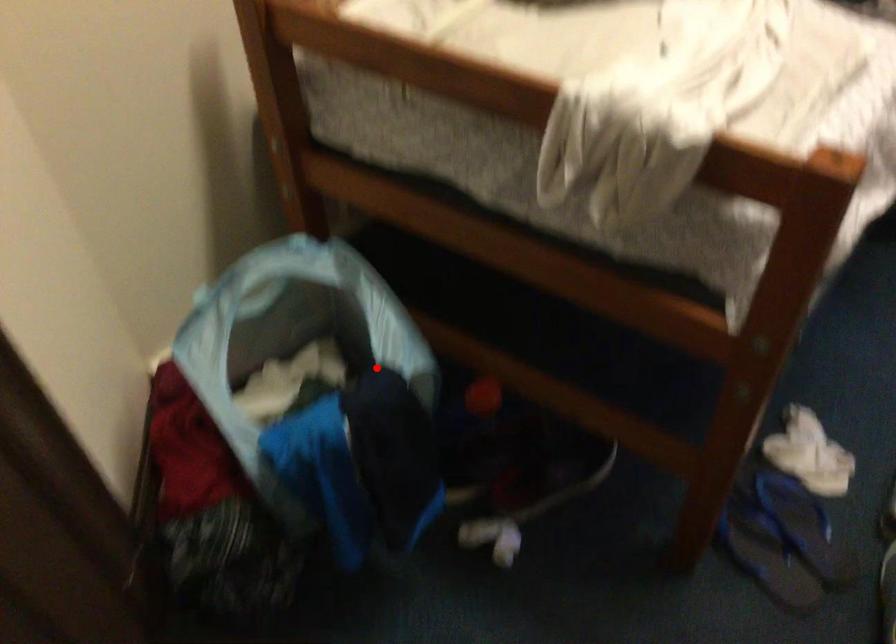
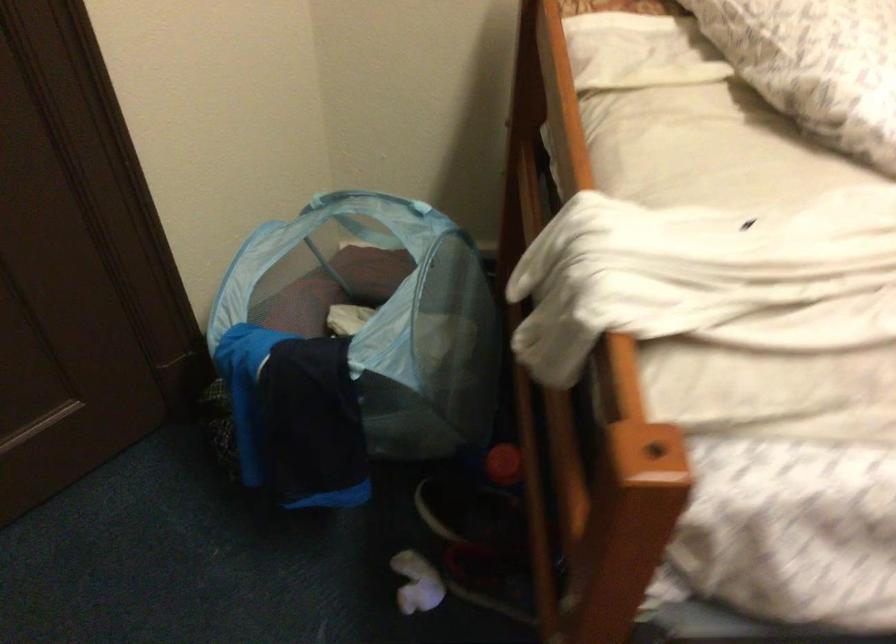
The point at the highlighted location is marked in the first image. Where is the corresponding point in the second image?

(354, 345)